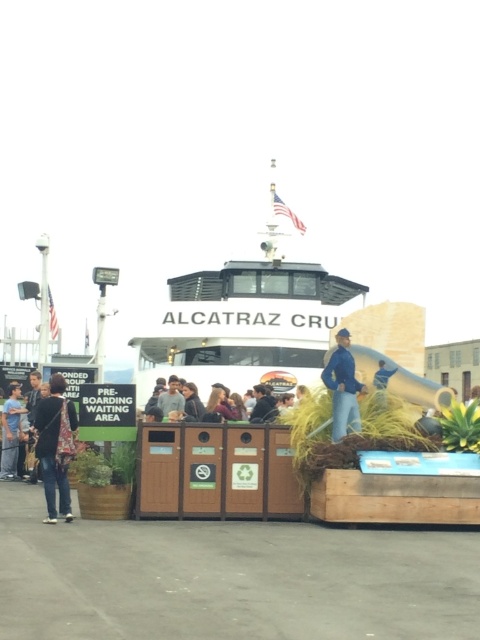
Is dark blue jeans at lower left positioned behind light brown leather jacket at center?

No, it is in front of light brown leather jacket at center.

Between dark blue jeans at lower left and light brown leather jacket at center, which one has more height?

Standing taller between the two is dark blue jeans at lower left.

Which is in front, point (50, 496) or point (172, 401)?

Point (50, 496)

Find the location of a particular element. dark blue jeans at lower left is located at coordinates (56, 445).

Between blue denim jacket at center and matte black jacket at center, which one has less height?

blue denim jacket at center is shorter.

Between point (349, 412) and point (225, 408), which one is positioned in front?

Positioned in front is point (349, 412).

At what (x,y) coordinates should I click in order to perform the action: click on blue denim jacket at center. Please return your answer as a coordinate pair (x, y). This screenshot has width=480, height=640. Looking at the image, I should click on (343, 387).

Image resolution: width=480 pixels, height=640 pixels. What do you see at coordinates (56, 445) in the screenshot?
I see `dark blue jeans at lower left` at bounding box center [56, 445].

Identify the location of dark blue jeans at lower left. The width and height of the screenshot is (480, 640). (56, 445).

Which is behind, point (48, 440) or point (349, 412)?

The point (349, 412) is more distant.

Find the location of a particular element. This screenshot has height=640, width=480. dark blue jeans at lower left is located at coordinates (56, 445).